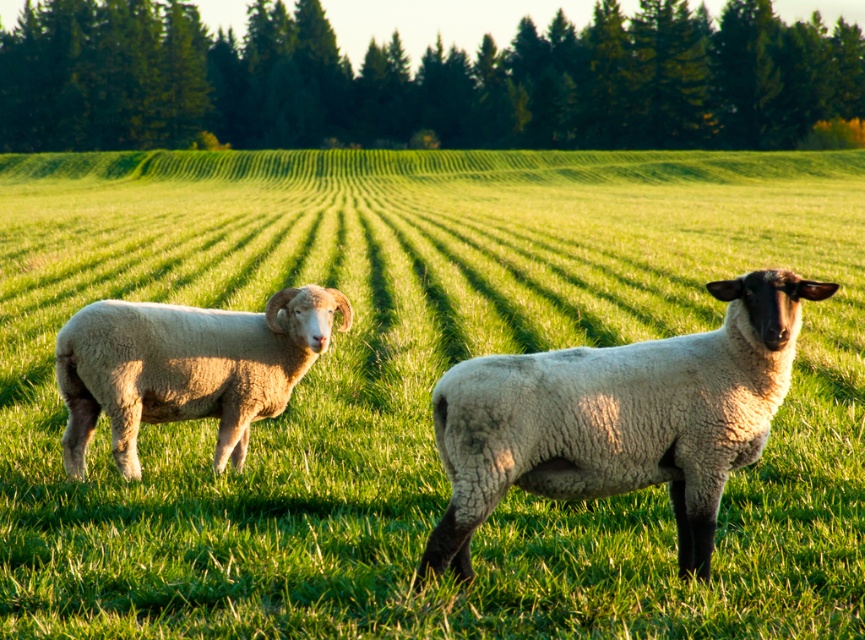
You are a photographer trying to capture a photo of the white woolly sheep at center and the light brown woolly ram at left. If you want to ensure both animals are in the same frame, which sheep should you position your camera closer to?

You should position your camera closer to the white woolly sheep at center because it is located below the light brown woolly ram at left, so adjusting the camera angle downward will help include both in the frame.

You are a shepherd trying to locate the white woolly sheep at center in the field. Based on the coordinates provided, can you determine its position relative to the center of the field?

The white woolly sheep at center is located at coordinates point (620, 419), which places it slightly to the right and below the exact center of the field.

You are a photographer trying to capture a photo of both the white woolly sheep at center and the light brown woolly ram at left. Since you want them both in the frame, which direction should you move your camera to include both animals?

To include both the white woolly sheep at center and the light brown woolly ram at left in the frame, you should move your camera to the left. This adjustment will ensure that the light brown woolly ram at left remains in view while also capturing the white woolly sheep at center, which is positioned to the right of the ram.